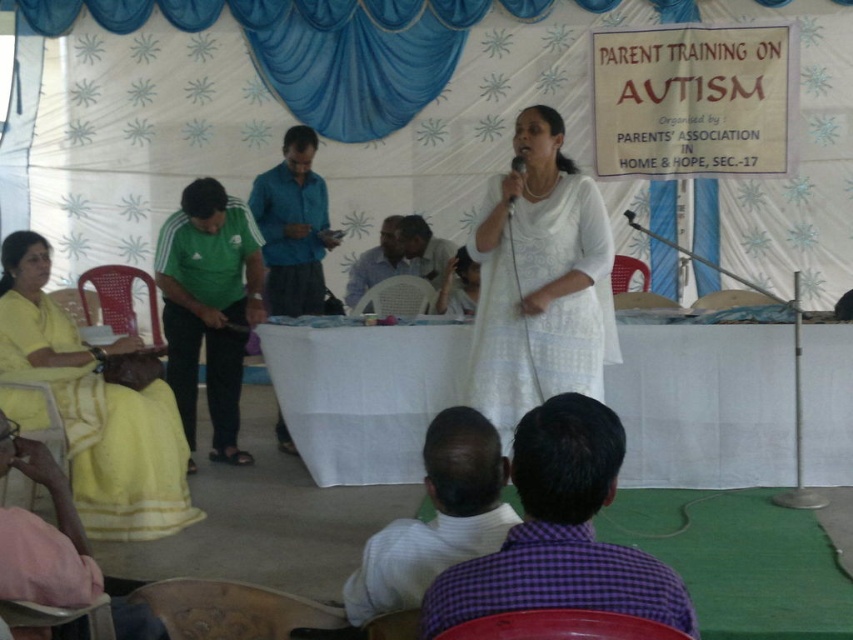
Question: Is white cloth table at center bigger than white cotton dress at center?

Choices:
 (A) yes
 (B) no

Answer: (B)

Question: Which object is the farthest from the metallic silver microphone at center?

Choices:
 (A) white striped shirt at lower center
 (B) blue fabric at center
 (C) pink fabric at lower left
 (D) white cloth table at center

Answer: (B)

Question: Can you confirm if purple checkered shirt at lower center is smaller than white striped shirt at lower center?

Choices:
 (A) yes
 (B) no

Answer: (B)

Question: Which of the following is the closest to the observer?

Choices:
 (A) (73, 582)
 (B) (425, 336)

Answer: (A)

Question: Which point is closer to the camera taking this photo?

Choices:
 (A) (79, 540)
 (B) (97, 444)
 (C) (585, 467)
 (D) (419, 403)

Answer: (C)

Question: In this image, where is green adidas tracksuit at left located relative to blue fabric at center?

Choices:
 (A) below
 (B) above

Answer: (A)